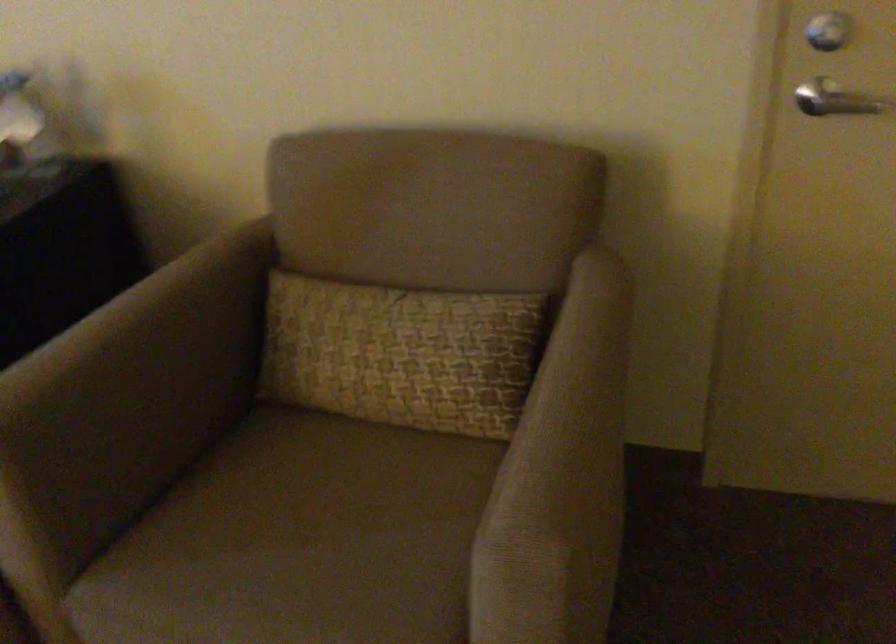
Describe the element at coordinates (314, 500) in the screenshot. The width and height of the screenshot is (896, 644). I see `a chair sitting surface` at that location.